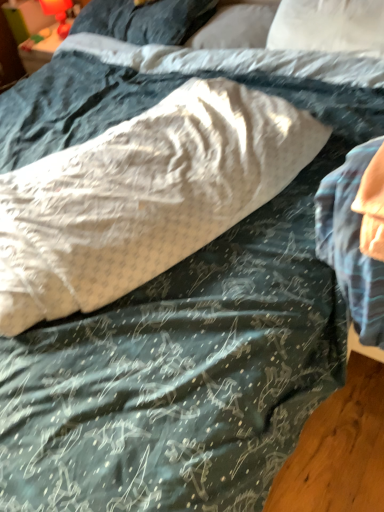
Question: Which direction should I rotate to face white soft pillow at upper center, the second pillow positioned from the top, — up or down?

Choices:
 (A) up
 (B) down

Answer: (A)

Question: Is white soft pillow at upper center, which appears as the 3th pillow when ordered from the bottom, not within white textured pillow at center, arranged as the first pillow when ordered from the bottom?

Choices:
 (A) no
 (B) yes

Answer: (B)

Question: Is white soft pillow at upper center, the second pillow positioned from the top, thinner than white textured pillow at center, which appears as the fourth pillow when viewed from the top?

Choices:
 (A) yes
 (B) no

Answer: (A)

Question: From the image's perspective, is white soft pillow at upper center, the second pillow positioned from the top, on white textured pillow at center, which appears as the fourth pillow when viewed from the top?

Choices:
 (A) no
 (B) yes

Answer: (B)

Question: Is white soft pillow at upper center, the second pillow positioned from the top, facing towards white textured pillow at center, which appears as the fourth pillow when viewed from the top?

Choices:
 (A) no
 (B) yes

Answer: (B)

Question: Are white soft pillow at upper center, which appears as the 3th pillow when ordered from the bottom, and white textured pillow at center, which appears as the fourth pillow when viewed from the top, located far from each other?

Choices:
 (A) no
 (B) yes

Answer: (A)

Question: Can you confirm if white soft pillow at upper center, the second pillow positioned from the top, is bigger than white textured pillow at center, which appears as the fourth pillow when viewed from the top?

Choices:
 (A) yes
 (B) no

Answer: (B)

Question: Considering the relative positions of white soft pillow at upper center, which is the third pillow from top to bottom, and white textured pillow at center, which appears as the fourth pillow when viewed from the top, in the image provided, is white soft pillow at upper center, which is the third pillow from top to bottom, behind white textured pillow at center, which appears as the fourth pillow when viewed from the top,?

Choices:
 (A) yes
 (B) no

Answer: (A)

Question: Is white soft pillow at upper center, which is the third pillow from top to bottom, to the right of white textured pillow at center, which appears as the fourth pillow when viewed from the top, from the viewer's perspective?

Choices:
 (A) no
 (B) yes

Answer: (B)

Question: From a real-world perspective, does white soft pillow at upper center, which is the third pillow from top to bottom, stand above white textured pillow at center, which appears as the fourth pillow when viewed from the top?

Choices:
 (A) yes
 (B) no

Answer: (A)

Question: Does white soft pillow at upper center, the second pillow in the bottom-to-top sequence, contain white textured pillow at center, arranged as the first pillow when ordered from the bottom?

Choices:
 (A) no
 (B) yes

Answer: (A)

Question: Considering the relative sizes of white soft pillow at upper center, the second pillow in the bottom-to-top sequence, and white textured pillow at center, which appears as the fourth pillow when viewed from the top, in the image provided, is white soft pillow at upper center, the second pillow in the bottom-to-top sequence, bigger than white textured pillow at center, which appears as the fourth pillow when viewed from the top,?

Choices:
 (A) yes
 (B) no

Answer: (B)

Question: From the image's perspective, does white soft pillow at upper center, which is the third pillow from top to bottom, appear lower than white textured pillow at center, which appears as the fourth pillow when viewed from the top?

Choices:
 (A) yes
 (B) no

Answer: (B)

Question: Is white textured pillow at center, which appears as the fourth pillow when viewed from the top, facing towards white soft pillow at upper center, the second pillow positioned from the top?

Choices:
 (A) no
 (B) yes

Answer: (A)